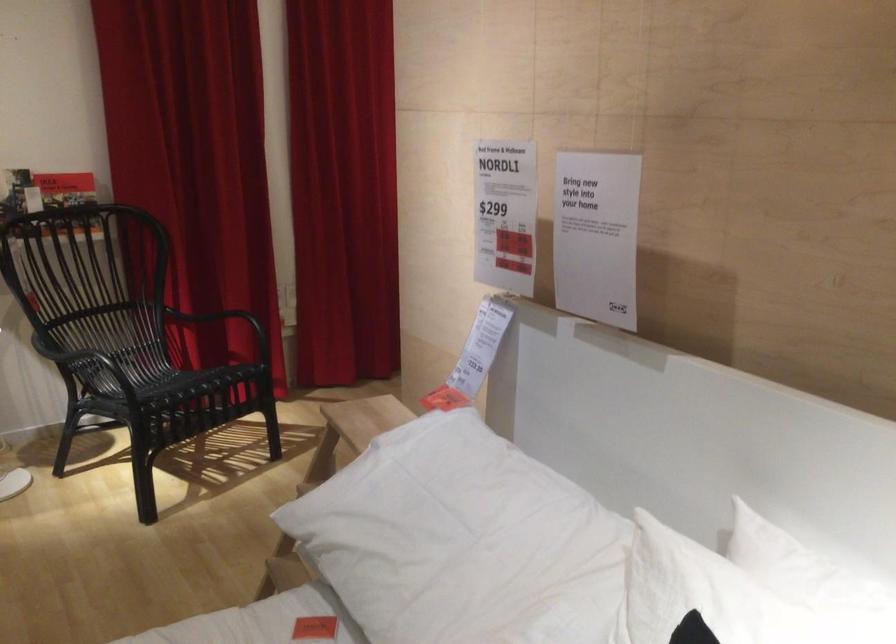
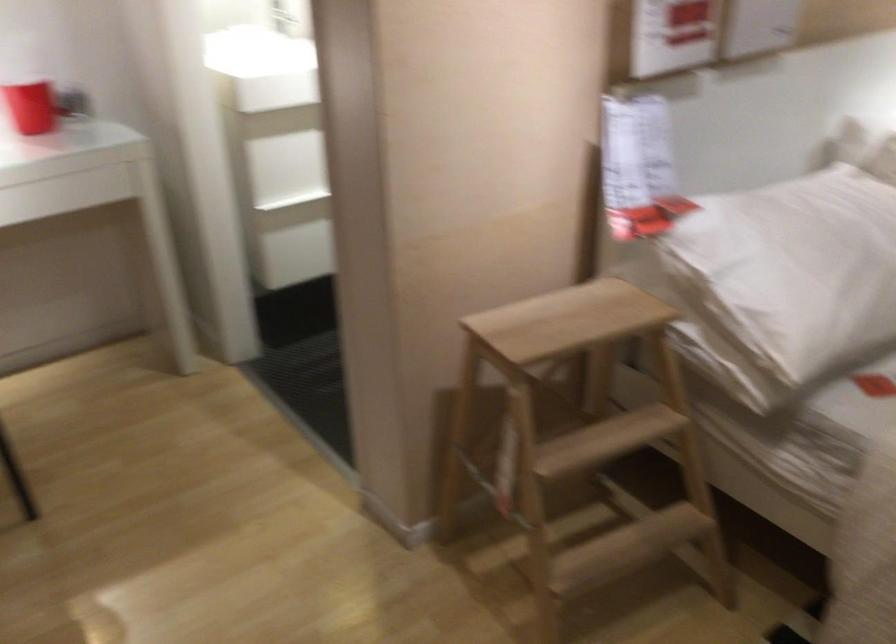
In the second image, find the point that corresponds to point 375,489 in the first image.

(785, 281)